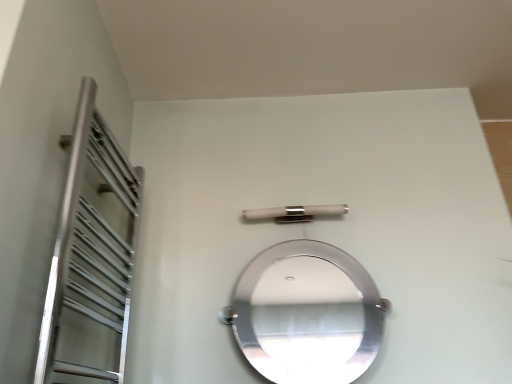
The height and width of the screenshot is (384, 512). What do you see at coordinates (91, 257) in the screenshot?
I see `silver metallic towel rack at left` at bounding box center [91, 257].

Locate an element on the screen. The height and width of the screenshot is (384, 512). satin nickel bar at center is located at coordinates [x=294, y=213].

Considering the relative sizes of satin nickel bar at center and silver metallic towel rack at left in the image provided, is satin nickel bar at center wider than silver metallic towel rack at left?

Incorrect, the width of satin nickel bar at center does not surpass that of silver metallic towel rack at left.

Between satin nickel bar at center and silver metallic towel rack at left, which one has more height?

silver metallic towel rack at left is taller.

Can you confirm if satin nickel bar at center is smaller than silver metallic towel rack at left?

Yes, satin nickel bar at center is smaller than silver metallic towel rack at left.

In the scene shown: Between satin nickel bar at center and silver metallic towel rack at left, which one appears on the right side from the viewer's perspective?

satin nickel bar at center is more to the right.

Does point (125, 232) come closer to viewer compared to point (333, 206)?

Yes, point (125, 232) is in front of point (333, 206).

Is satin nickel bar at center located within silver metallic towel rack at left?

No, satin nickel bar at center is not a part of silver metallic towel rack at left.

In the image, there is a silver metallic towel rack at left. Where is `door handle above it (from the image's perspective)`? This screenshot has height=384, width=512. door handle above it (from the image's perspective) is located at coordinates (294, 213).

From a real-world perspective, is silver metallic towel rack at left on satin nickel bar at center?

Actually, silver metallic towel rack at left is physically below satin nickel bar at center in the real world.

Would you say polished silver mirror at center is to the left or to the right of satin nickel bar at center in the picture?

Based on their positions, polished silver mirror at center is located to the right of satin nickel bar at center.

Where is `door handle on the left of polished silver mirror at center`? door handle on the left of polished silver mirror at center is located at coordinates (294, 213).

Which object is wider, polished silver mirror at center or satin nickel bar at center?

polished silver mirror at center is wider.

Between polished silver mirror at center and satin nickel bar at center, which one has more height?

With more height is polished silver mirror at center.

From the image's perspective, which is below, satin nickel bar at center or polished silver mirror at center?

From the image's view, polished silver mirror at center is below.

Identify the location of mirror below the satin nickel bar at center (from the image's perspective). click(307, 318).

From a real-world perspective, which object rests below the other?

From a 3D spatial view, polished silver mirror at center is below.

Can you tell me how much satin nickel bar at center and polished silver mirror at center differ in facing direction?

There is a 0.662-degree angle between the facing directions of satin nickel bar at center and polished silver mirror at center.

Can you confirm if polished silver mirror at center is shorter than silver metallic towel rack at left?

Correct, polished silver mirror at center is not as tall as silver metallic towel rack at left.

From the image's perspective, which one is positioned lower, polished silver mirror at center or silver metallic towel rack at left?

polished silver mirror at center, from the image's perspective.

From a real-world perspective, is polished silver mirror at center over silver metallic towel rack at left?

Actually, polished silver mirror at center is physically below silver metallic towel rack at left in the real world.

What's the angular difference between silver metallic towel rack at left and polished silver mirror at center's facing directions?

89.4 degrees separate the facing orientations of silver metallic towel rack at left and polished silver mirror at center.

Is silver metallic towel rack at left positioned behind polished silver mirror at center?

No, silver metallic towel rack at left is closer to the camera.

Is silver metallic towel rack at left at the left side of polished silver mirror at center?

Correct, you'll find silver metallic towel rack at left to the left of polished silver mirror at center.

Is silver metallic towel rack at left facing towards polished silver mirror at center?

Yes, silver metallic towel rack at left is turned towards polished silver mirror at center.

Locate an element on the screen. screen door below the satin nickel bar at center (from the image's perspective) is located at coordinates (91, 257).

In the image, there is a satin nickel bar at center. Identify the location of screen door below it (from a real-world perspective). This screenshot has height=384, width=512. (91, 257).

Considering their positions, is silver metallic towel rack at left positioned further to polished silver mirror at center than satin nickel bar at center?

silver metallic towel rack at left is further to polished silver mirror at center.

Based on their spatial positions, is polished silver mirror at center or silver metallic towel rack at left closer to satin nickel bar at center?

silver metallic towel rack at left lies closer to satin nickel bar at center than the other object.

Based on their spatial positions, is polished silver mirror at center or satin nickel bar at center closer to silver metallic towel rack at left?

satin nickel bar at center is closer to silver metallic towel rack at left.

Estimate the real-world distances between objects in this image. Which object is further from polished silver mirror at center, satin nickel bar at center or silver metallic towel rack at left?

silver metallic towel rack at left lies further to polished silver mirror at center than the other object.

Looking at the image, which one is located closer to satin nickel bar at center, silver metallic towel rack at left or polished silver mirror at center?

silver metallic towel rack at left is positioned closer to the anchor satin nickel bar at center.

When comparing their distances from silver metallic towel rack at left, does satin nickel bar at center or polished silver mirror at center seem further?

polished silver mirror at center lies further to silver metallic towel rack at left than the other object.

This screenshot has height=384, width=512. In order to click on mirror positioned between silver metallic towel rack at left and satin nickel bar at center from near to far in this screenshot , I will do `click(307, 318)`.